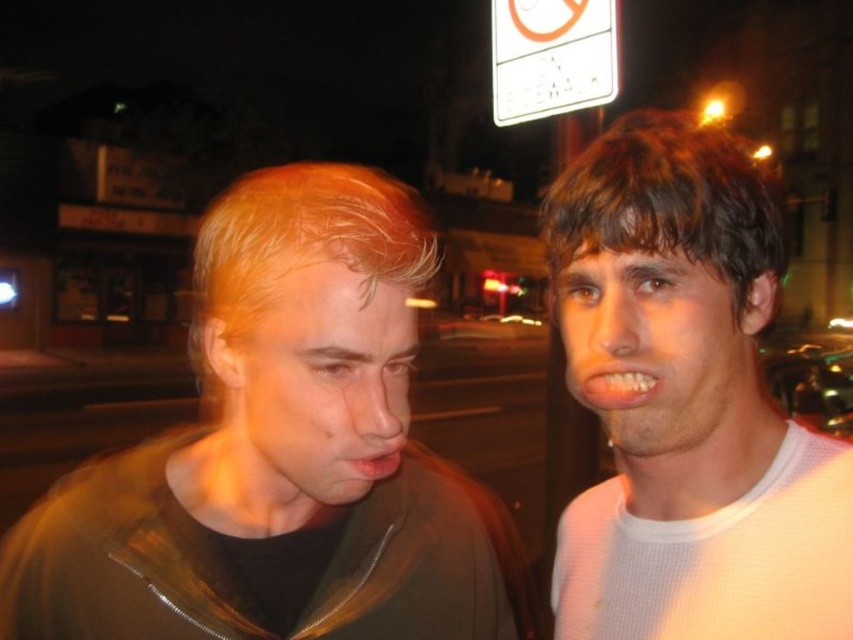
Is light brown hair at right to the left of white plastic sign at upper center from the viewer's perspective?

Yes, light brown hair at right is to the left of white plastic sign at upper center.

Does point (633, 173) come in front of point (602, 67)?

Yes, it is in front of point (602, 67).

The width and height of the screenshot is (853, 640). In order to click on light brown hair at right in this screenshot , I will do `click(686, 403)`.

Locate an element on the screen. The image size is (853, 640). light brown hair at right is located at coordinates (686, 403).

This screenshot has height=640, width=853. What do you see at coordinates (281, 452) in the screenshot?
I see `matte brown jacket at left` at bounding box center [281, 452].

At what (x,y) coordinates should I click in order to perform the action: click on matte brown jacket at left. Please return your answer as a coordinate pair (x, y). Looking at the image, I should click on (281, 452).

Which is below, matte brown jacket at left or white plastic sign at upper center?

Positioned lower is matte brown jacket at left.

Is point (310, 380) positioned in front of point (512, 72)?

That is True.

Locate an element on the screen. Image resolution: width=853 pixels, height=640 pixels. matte brown jacket at left is located at coordinates (281, 452).